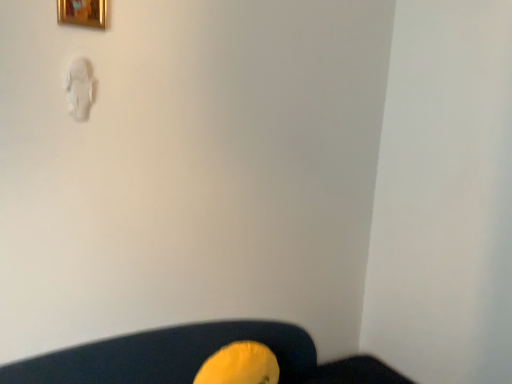
The width and height of the screenshot is (512, 384). In order to click on yellow fabric bean bag chair at lower center in this screenshot , I will do `click(240, 365)`.

This screenshot has width=512, height=384. What do you see at coordinates (240, 365) in the screenshot?
I see `yellow fabric bean bag chair at lower center` at bounding box center [240, 365].

Image resolution: width=512 pixels, height=384 pixels. What do you see at coordinates (82, 12) in the screenshot?
I see `gold metallic picture frame at upper left` at bounding box center [82, 12].

Locate an element on the screen. The height and width of the screenshot is (384, 512). gold metallic picture frame at upper left is located at coordinates (82, 12).

The image size is (512, 384). Find the location of `yellow fabric bean bag chair at lower center`. yellow fabric bean bag chair at lower center is located at coordinates (240, 365).

Is gold metallic picture frame at upper left at the right side of yellow fabric bean bag chair at lower center?

No.

Does gold metallic picture frame at upper left come in front of yellow fabric bean bag chair at lower center?

Yes, gold metallic picture frame at upper left is closer to the viewer.

Considering the positions of points (86, 19) and (246, 373), is point (86, 19) farther from camera compared to point (246, 373)?

No, (86, 19) is closer to viewer.

From the image's perspective, is gold metallic picture frame at upper left positioned above or below yellow fabric bean bag chair at lower center?

Based on their image positions, gold metallic picture frame at upper left is located above yellow fabric bean bag chair at lower center.

In the scene shown: From a real-world perspective, which object rests below the other?

From a 3D spatial view, yellow fabric bean bag chair at lower center is below.

Is gold metallic picture frame at upper left wider or thinner than yellow fabric bean bag chair at lower center?

gold metallic picture frame at upper left is thinner than yellow fabric bean bag chair at lower center.

Can you confirm if gold metallic picture frame at upper left is shorter than yellow fabric bean bag chair at lower center?

Yes, gold metallic picture frame at upper left is shorter than yellow fabric bean bag chair at lower center.

Considering the relative sizes of gold metallic picture frame at upper left and yellow fabric bean bag chair at lower center in the image provided, is gold metallic picture frame at upper left smaller than yellow fabric bean bag chair at lower center?

Indeed, gold metallic picture frame at upper left has a smaller size compared to yellow fabric bean bag chair at lower center.

In the scene shown: Is yellow fabric bean bag chair at lower center located within gold metallic picture frame at upper left?

No, yellow fabric bean bag chair at lower center is not inside gold metallic picture frame at upper left.

Is gold metallic picture frame at upper left in contact with yellow fabric bean bag chair at lower center?

gold metallic picture frame at upper left and yellow fabric bean bag chair at lower center are not in contact.

Is gold metallic picture frame at upper left oriented away from yellow fabric bean bag chair at lower center?

No, gold metallic picture frame at upper left is not facing the opposite direction of yellow fabric bean bag chair at lower center.

At what (x,y) coordinates should I click in order to perform the action: click on bean bag chair below the gold metallic picture frame at upper left (from the image's perspective). Please return your answer as a coordinate pair (x, y). Looking at the image, I should click on (240, 365).

Which is more to the left, yellow fabric bean bag chair at lower center or gold metallic picture frame at upper left?

Positioned to the left is gold metallic picture frame at upper left.

Which object is closer to the camera taking this photo, yellow fabric bean bag chair at lower center or gold metallic picture frame at upper left?

Positioned in front is gold metallic picture frame at upper left.

Between point (199, 374) and point (94, 10), which one is positioned in front?

The point (94, 10) is more forward.

From the image's perspective, would you say yellow fabric bean bag chair at lower center is positioned over gold metallic picture frame at upper left?

No, from the image's perspective, yellow fabric bean bag chair at lower center is not on top of gold metallic picture frame at upper left.

From a real-world perspective, between yellow fabric bean bag chair at lower center and gold metallic picture frame at upper left, who is vertically higher?

gold metallic picture frame at upper left is physically above.

Does yellow fabric bean bag chair at lower center have a lesser width compared to gold metallic picture frame at upper left?

Incorrect, the width of yellow fabric bean bag chair at lower center is not less than that of gold metallic picture frame at upper left.

Is yellow fabric bean bag chair at lower center taller or shorter than gold metallic picture frame at upper left?

In the image, yellow fabric bean bag chair at lower center appears to be taller than gold metallic picture frame at upper left.

Between yellow fabric bean bag chair at lower center and gold metallic picture frame at upper left, which one has larger size?

With larger size is yellow fabric bean bag chair at lower center.

Would you say yellow fabric bean bag chair at lower center is inside or outside gold metallic picture frame at upper left?

yellow fabric bean bag chair at lower center cannot be found inside gold metallic picture frame at upper left.

Is yellow fabric bean bag chair at lower center positioned far away from gold metallic picture frame at upper left?

Yes.

Is yellow fabric bean bag chair at lower center facing towards gold metallic picture frame at upper left?

No, yellow fabric bean bag chair at lower center is not facing towards gold metallic picture frame at upper left.

What's the angular difference between yellow fabric bean bag chair at lower center and gold metallic picture frame at upper left's facing directions?

The angle between the facing direction of yellow fabric bean bag chair at lower center and the facing direction of gold metallic picture frame at upper left is 6.99 degrees.

Measure the distance between yellow fabric bean bag chair at lower center and gold metallic picture frame at upper left.

yellow fabric bean bag chair at lower center is 1.15 meters from gold metallic picture frame at upper left.

Where is `bean bag chair lying behind the gold metallic picture frame at upper left`? bean bag chair lying behind the gold metallic picture frame at upper left is located at coordinates (240, 365).

The height and width of the screenshot is (384, 512). Find the location of `bean bag chair on the right of gold metallic picture frame at upper left`. bean bag chair on the right of gold metallic picture frame at upper left is located at coordinates (240, 365).

Locate an element on the screen. bean bag chair that appears below the gold metallic picture frame at upper left (from a real-world perspective) is located at coordinates (240, 365).